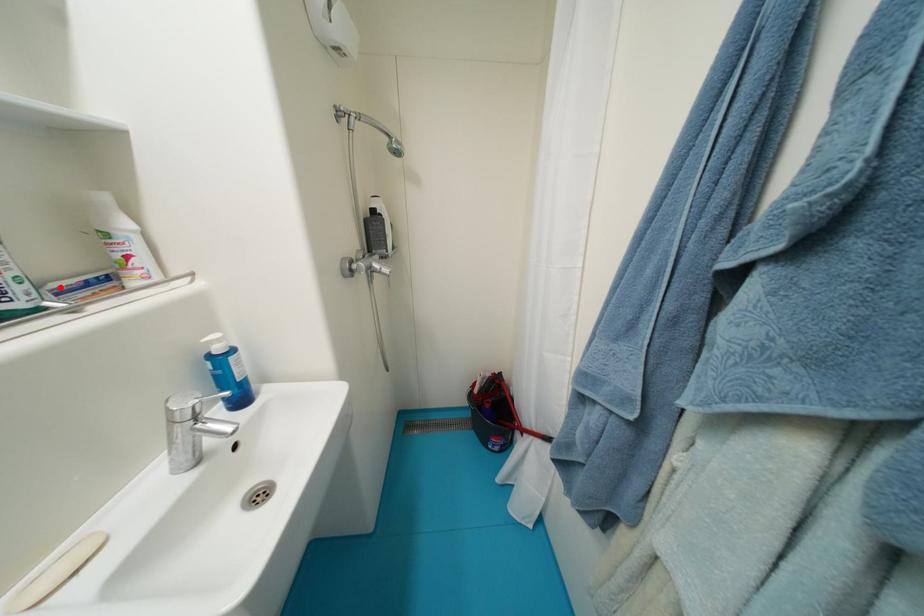
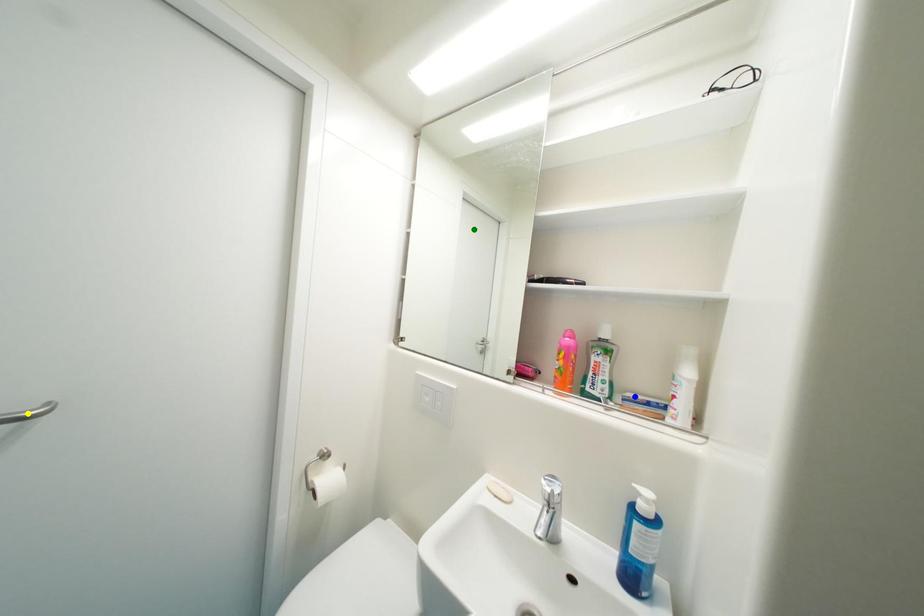
Question: I am providing you with two images of the same scene from different viewpoints. A red point is marked on the first image. You are given multiple points on the second image. Which point in image 2 represents the same 3d spot as the red point in image 1?

Choices:
 (A) yellow point
 (B) blue point
 (C) green point

Answer: (B)